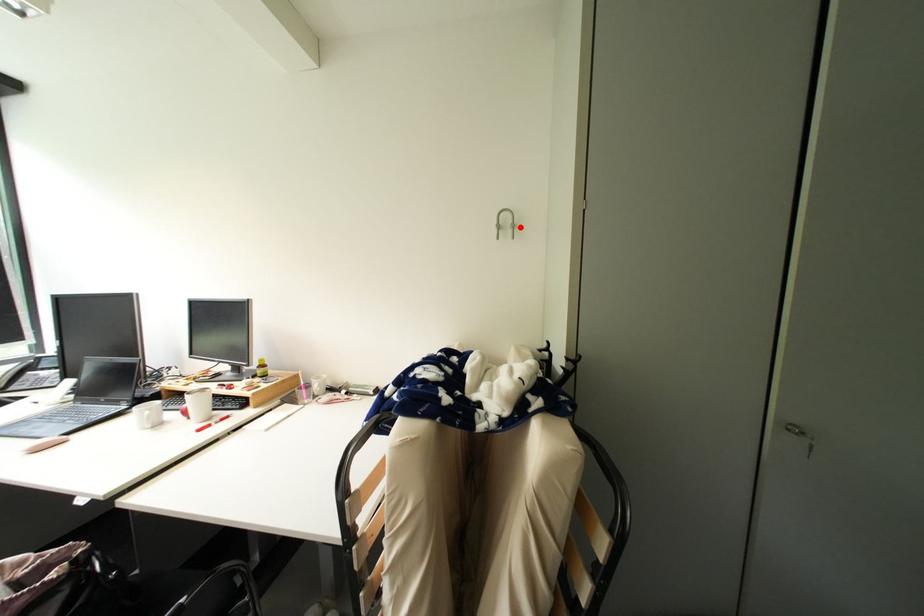
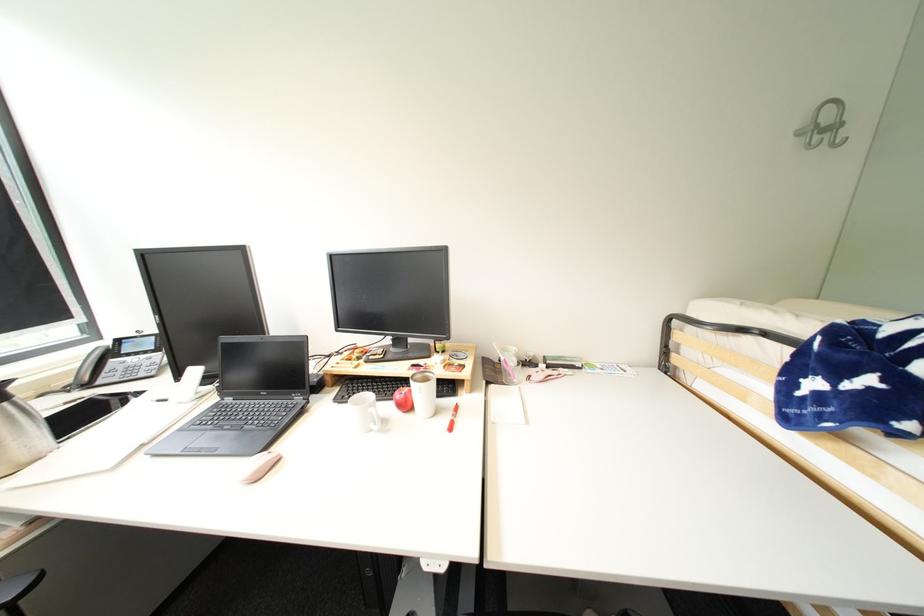
In the second image, find the point that corresponds to the highlighted location in the first image.

(841, 128)